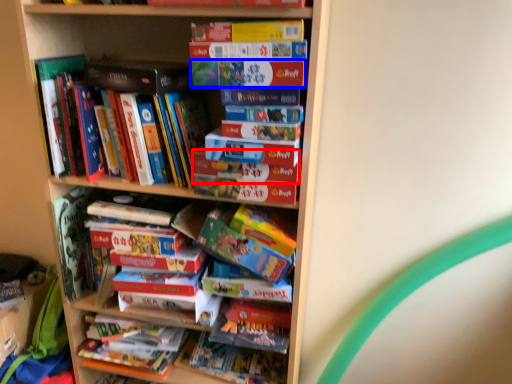
Question: Which of the following is the farthest to the observer, paperback book (highlighted by a red box) or paperback book (highlighted by a blue box)?

Choices:
 (A) paperback book
 (B) paperback book

Answer: (A)